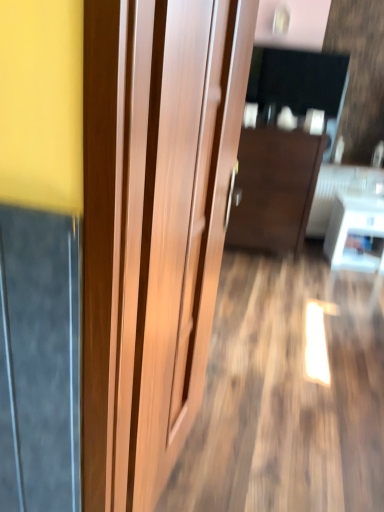
Question: Is dark wood cabinet at center taller or shorter than wooden door at center?

Choices:
 (A) tall
 (B) short

Answer: (B)

Question: From a real-world perspective, is dark wood cabinet at center physically located above or below wooden door at center?

Choices:
 (A) above
 (B) below

Answer: (B)

Question: Estimate the real-world distances between objects in this image. Which object is farther from the wooden door at center?

Choices:
 (A) dark wood cabinet at center
 (B) white glossy table at lower right

Answer: (B)

Question: Estimate the real-world distances between objects in this image. Which object is closer to the dark wood cabinet at center?

Choices:
 (A) white glossy table at lower right
 (B) wooden door at center

Answer: (A)